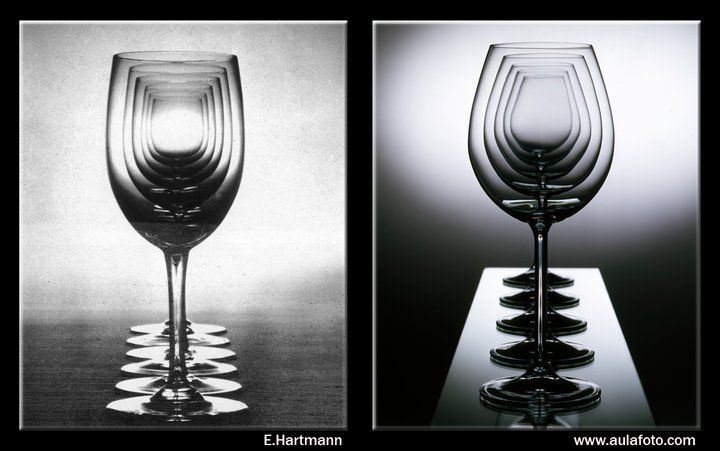
The width and height of the screenshot is (720, 451). What are the coordinates of `wine glasses on the left` in the screenshot? It's located at (155, 328), (150, 339), (153, 347), (147, 365), (145, 381), (142, 407).